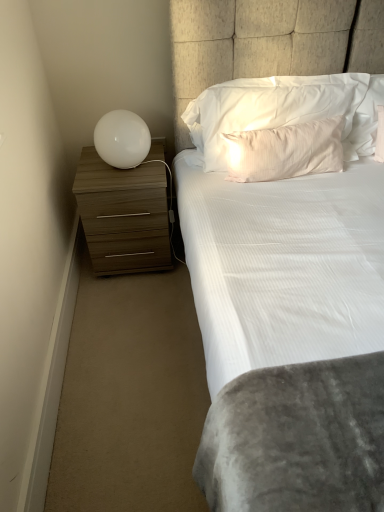
Question: From the image's perspective, is white satin pillow at upper center, which is the 2th pillow from top to bottom, located above or below wooden chest of drawers at left?

Choices:
 (A) above
 (B) below

Answer: (A)

Question: Choose the correct answer: Is white satin pillow at upper center, the 1th pillow when ordered from bottom to top, inside wooden chest of drawers at left or outside it?

Choices:
 (A) outside
 (B) inside

Answer: (A)

Question: Based on their relative distances, which object is farther from the white satin pillow at upper center, which is the 2th pillow from top to bottom?

Choices:
 (A) white soft pillow at upper center, which is the 2th pillow from bottom to top
 (B) white glossy sphere at left
 (C) wooden chest of drawers at left

Answer: (B)

Question: Which is nearer to the white glossy sphere at left?

Choices:
 (A) white soft pillow at upper center, which is the 2th pillow from bottom to top
 (B) wooden chest of drawers at left
 (C) white satin pillow at upper center, the 1th pillow when ordered from bottom to top

Answer: (B)